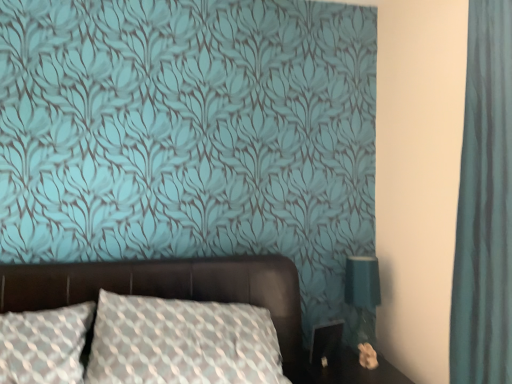
Question: Does teal fabric lampshade at right appear on the left side of leather bed at center?

Choices:
 (A) no
 (B) yes

Answer: (A)

Question: Is teal fabric lampshade at right looking in the opposite direction of leather bed at center?

Choices:
 (A) yes
 (B) no

Answer: (B)

Question: Does teal fabric lampshade at right have a larger size compared to leather bed at center?

Choices:
 (A) yes
 (B) no

Answer: (B)

Question: Can you confirm if teal fabric lampshade at right is wider than leather bed at center?

Choices:
 (A) yes
 (B) no

Answer: (B)

Question: Is teal fabric lampshade at right closer to the viewer compared to leather bed at center?

Choices:
 (A) no
 (B) yes

Answer: (A)

Question: Considering the positions of leather bed at center and black glossy table at lower right in the image, is leather bed at center wider or thinner than black glossy table at lower right?

Choices:
 (A) thin
 (B) wide

Answer: (B)

Question: From a real-world perspective, is leather bed at center above or below black glossy table at lower right?

Choices:
 (A) below
 (B) above

Answer: (B)

Question: Is leather bed at center to the left or to the right of black glossy table at lower right in the image?

Choices:
 (A) left
 (B) right

Answer: (A)

Question: Is leather bed at center taller or shorter than black glossy table at lower right?

Choices:
 (A) short
 (B) tall

Answer: (B)

Question: From a real-world perspective, is leather bed at center above or below teal fabric curtain at right?

Choices:
 (A) below
 (B) above

Answer: (A)

Question: Is leather bed at center inside or outside of teal fabric curtain at right?

Choices:
 (A) inside
 (B) outside

Answer: (B)

Question: Looking at the image, does leather bed at center seem bigger or smaller compared to teal fabric curtain at right?

Choices:
 (A) big
 (B) small

Answer: (A)

Question: From their relative heights in the image, would you say leather bed at center is taller or shorter than teal fabric curtain at right?

Choices:
 (A) short
 (B) tall

Answer: (A)

Question: Is leather bed at center in front of or behind teal fabric lampshade at right in the image?

Choices:
 (A) front
 (B) behind

Answer: (A)

Question: Is leather bed at center inside the boundaries of teal fabric lampshade at right, or outside?

Choices:
 (A) outside
 (B) inside

Answer: (A)